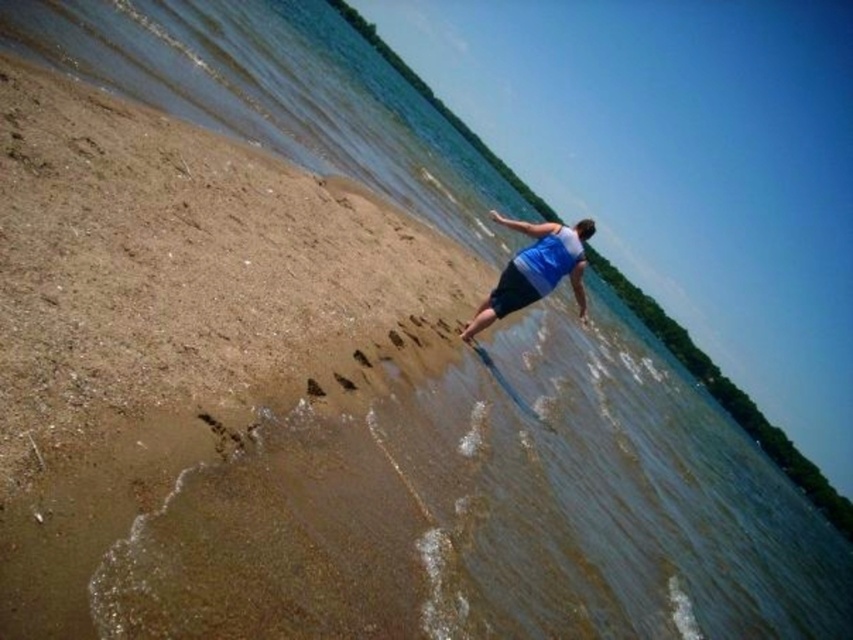
Between brown sand at center and brown sand at lower center, which one appears on the right side from the viewer's perspective?

brown sand at lower center

Locate an element on the screen. The image size is (853, 640). brown sand at center is located at coordinates (314, 388).

The height and width of the screenshot is (640, 853). I want to click on brown sand at center, so click(x=314, y=388).

Can you confirm if blue fabric shorts at center is wider than brown sand at lower center?

Yes.

The image size is (853, 640). Find the location of `blue fabric shorts at center`. blue fabric shorts at center is located at coordinates (511, 291).

Which is in front, point (511, 284) or point (337, 381)?

Point (337, 381)

At what (x,y) coordinates should I click in order to perform the action: click on blue fabric shorts at center. Please return your answer as a coordinate pair (x, y). This screenshot has height=640, width=853. Looking at the image, I should click on [x=511, y=291].

This screenshot has height=640, width=853. What do you see at coordinates (535, 269) in the screenshot? I see `blue fabric man at center` at bounding box center [535, 269].

Which is below, blue fabric man at center or brown sand at center?

brown sand at center is below.

At what (x,y) coordinates should I click in order to perform the action: click on blue fabric man at center. Please return your answer as a coordinate pair (x, y). The height and width of the screenshot is (640, 853). Looking at the image, I should click on (535, 269).

At what (x,y) coordinates should I click in order to perform the action: click on blue fabric man at center. Please return your answer as a coordinate pair (x, y). The width and height of the screenshot is (853, 640). Looking at the image, I should click on (535, 269).